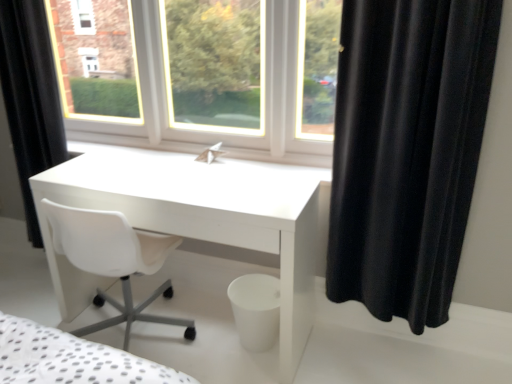
This screenshot has height=384, width=512. Identify the location of free region under black velvet curtain at right, marked as the 1th curtain in a front-to-back arrangement (from a real-world perspective). (386, 329).